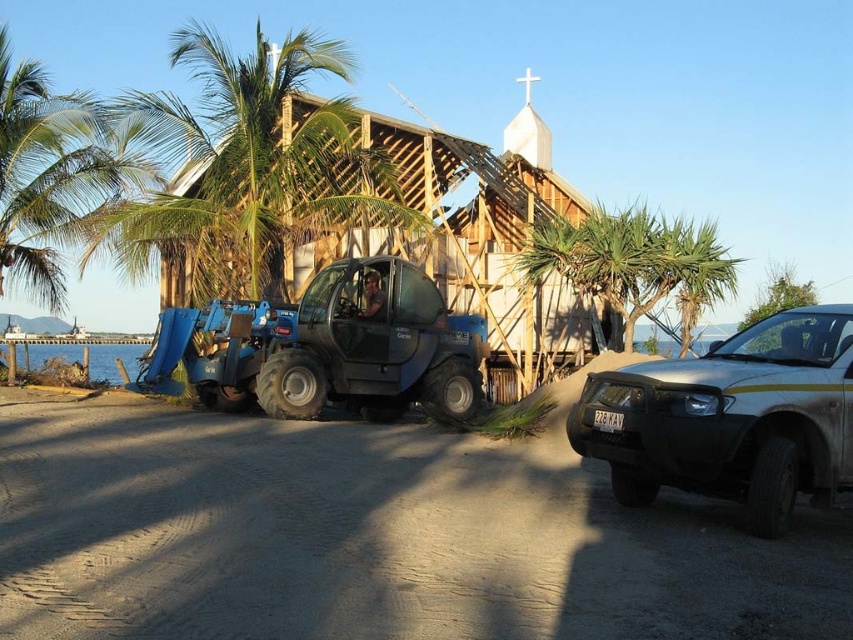
Is green leafy palm tree at center taller than green leafy palm tree at upper left?

No, green leafy palm tree at center is not taller than green leafy palm tree at upper left.

Based on the photo, which is below, green leafy palm tree at center or green leafy palm tree at upper left?

green leafy palm tree at center

Between point (200, 131) and point (0, 93), which one is positioned in front?

Point (200, 131)

This screenshot has width=853, height=640. In order to click on green leafy palm tree at center in this screenshot , I will do `click(248, 164)`.

Consider the image. How much distance is there between wooden frame hut at center and green leafy palm tree at upper left?

wooden frame hut at center and green leafy palm tree at upper left are 6.24 meters apart.

Does wooden frame hut at center appear on the left side of green leafy palm tree at upper left?

No, wooden frame hut at center is not to the left of green leafy palm tree at upper left.

Does point (573, 323) come behind point (4, 35)?

That is True.

This screenshot has width=853, height=640. What are the coordinates of `wooden frame hut at center` in the screenshot? It's located at (474, 237).

Does silver metallic suv at right have a smaller size compared to wooden frame hut at center?

Correct, silver metallic suv at right occupies less space than wooden frame hut at center.

Which of these two, silver metallic suv at right or wooden frame hut at center, stands shorter?

Standing shorter between the two is silver metallic suv at right.

What are the coordinates of `silver metallic suv at right` in the screenshot? It's located at (730, 419).